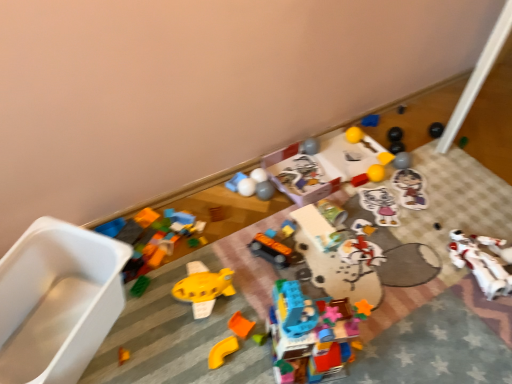
Identify the location of free space that is in between matte plastic sticker at center, which is the second toy in right-to-left order, and matte black car at center, the eighth toy positioned from the left. (356, 218).